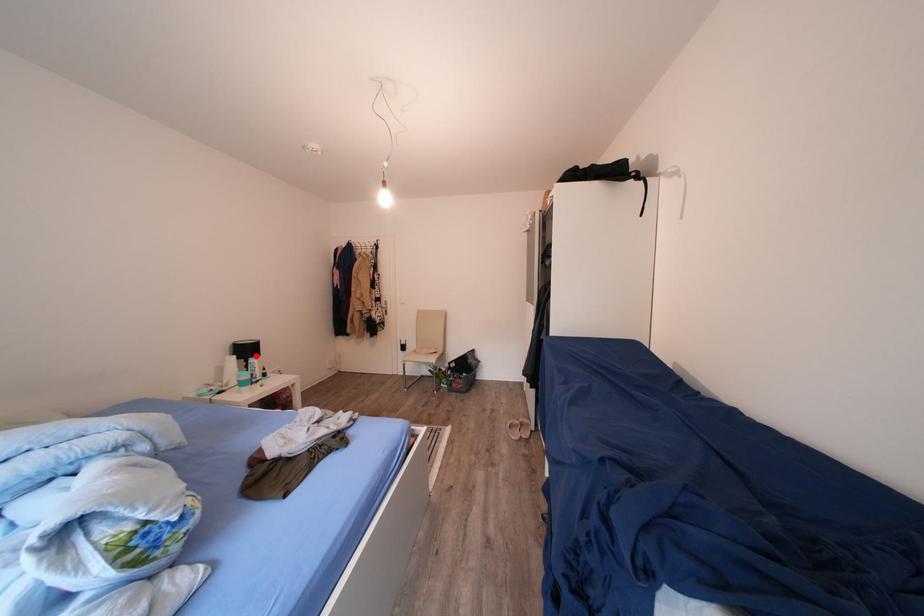
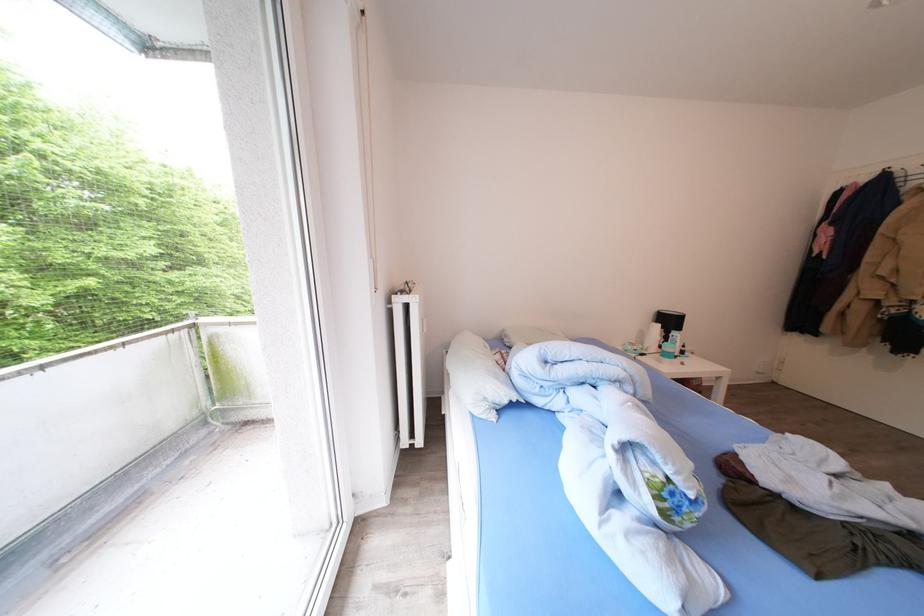
Where in the second image is the point corresponding to the highlighted location from the first image?

(677, 326)